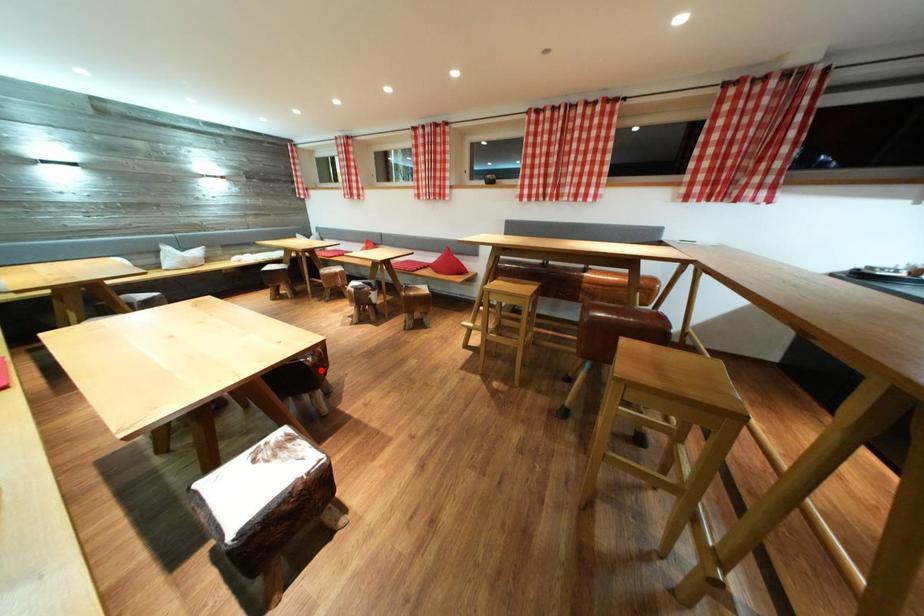
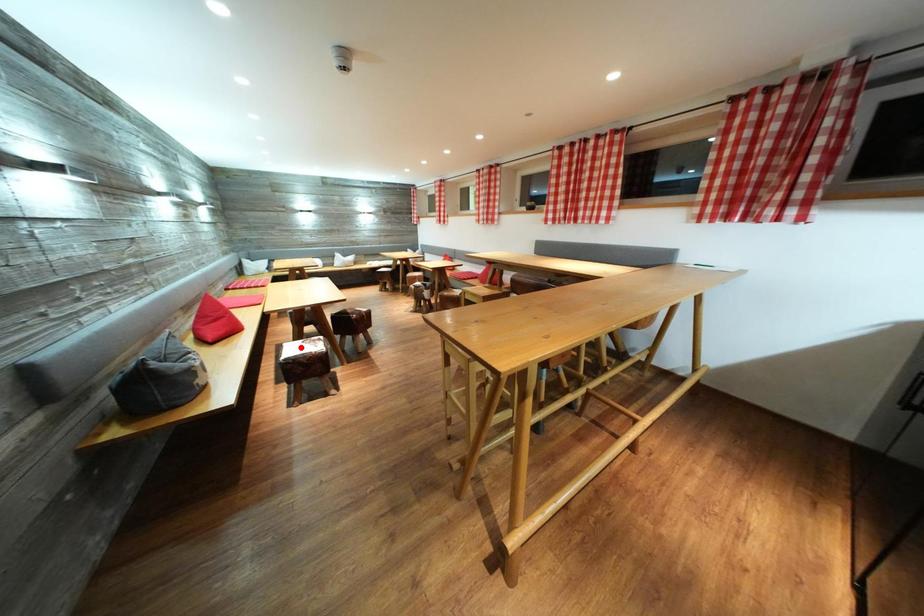
I am providing you with two images of the same scene from different viewpoints. A red point is marked on the first image and another point is marked on the second image. Do the highlighted points in image1 and image2 indicate the same real-world spot?

No